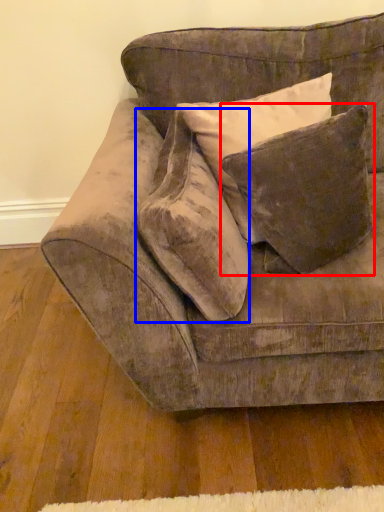
Question: Which of the following is the closest to the observer, pillow (highlighted by a red box) or throw pillow (highlighted by a blue box)?

Choices:
 (A) pillow
 (B) throw pillow

Answer: (B)